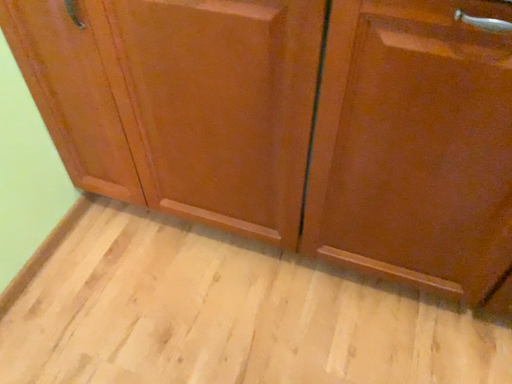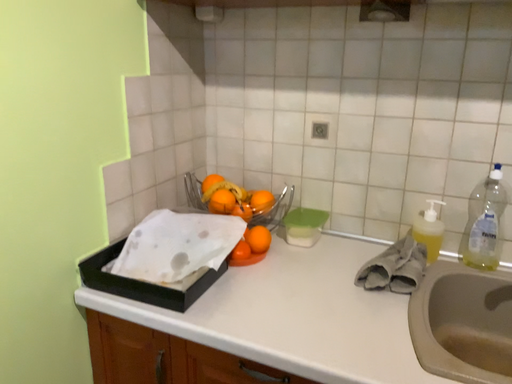
Question: How did the camera likely rotate when shooting the video?

Choices:
 (A) rotated upward
 (B) rotated downward

Answer: (A)